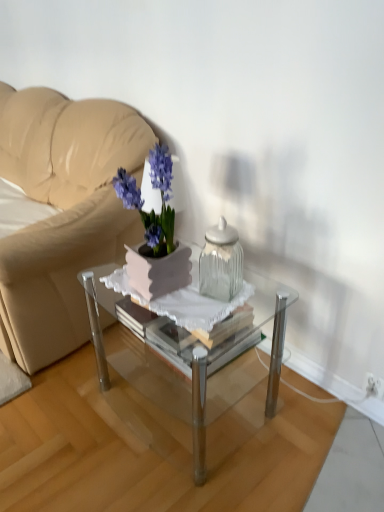
This screenshot has height=512, width=384. Describe the element at coordinates (374, 386) in the screenshot. I see `white plastic electric outlet at lower right` at that location.

In order to click on beige leather couch at upper left in this screenshot , I will do `click(62, 212)`.

The width and height of the screenshot is (384, 512). Describe the element at coordinates (221, 262) in the screenshot. I see `clear glass jar at center` at that location.

Identify the location of matte purple flower pot at center. This screenshot has width=384, height=512. (155, 232).

Describe the element at coordinates (155, 232) in the screenshot. I see `matte purple flower pot at center` at that location.

The width and height of the screenshot is (384, 512). I want to click on clear glass coffee table at center, so click(229, 353).

Looking at this image, could you measure the distance between white plastic electric outlet at lower right and clear glass coffee table at center?

They are 24.55 inches apart.

From the image's perspective, is white plastic electric outlet at lower right below clear glass coffee table at center?

Yes, from the image's perspective, white plastic electric outlet at lower right is beneath clear glass coffee table at center.

Does white plastic electric outlet at lower right have a lesser width compared to clear glass coffee table at center?

Correct, the width of white plastic electric outlet at lower right is less than that of clear glass coffee table at center.

From a real-world perspective, is white plastic electric outlet at lower right physically located above or below clear glass coffee table at center?

From a real-world perspective, white plastic electric outlet at lower right is physically below clear glass coffee table at center.

Consider the image. Would you say clear glass coffee table at center is outside beige leather couch at upper left?

Yes.

Based on the photo, which is behind, clear glass coffee table at center or beige leather couch at upper left?

Positioned behind is beige leather couch at upper left.

From the image's perspective, does clear glass coffee table at center appear lower than beige leather couch at upper left?

Indeed, from the image's perspective, clear glass coffee table at center is shown beneath beige leather couch at upper left.

From the image's perspective, is beige leather couch at upper left positioned above or below clear glass coffee table at center?

From the image's perspective, beige leather couch at upper left appears above clear glass coffee table at center.

Considering the relative sizes of beige leather couch at upper left and clear glass coffee table at center in the image provided, is beige leather couch at upper left thinner than clear glass coffee table at center?

Incorrect, the width of beige leather couch at upper left is not less than that of clear glass coffee table at center.

Is beige leather couch at upper left inside or outside of clear glass coffee table at center?

beige leather couch at upper left is outside clear glass coffee table at center.

Considering the relative sizes of matte purple flower pot at center and clear glass coffee table at center in the image provided, is matte purple flower pot at center smaller than clear glass coffee table at center?

Indeed, matte purple flower pot at center has a smaller size compared to clear glass coffee table at center.

Is matte purple flower pot at center oriented towards clear glass coffee table at center?

No, matte purple flower pot at center is not oriented towards clear glass coffee table at center.

Identify the location of electric outlet that appears on the right of matte purple flower pot at center. (374, 386).

Considering their positions, is matte purple flower pot at center located in front of or behind white plastic electric outlet at lower right?

matte purple flower pot at center is in front of white plastic electric outlet at lower right.

Between matte purple flower pot at center and white plastic electric outlet at lower right, which one has less height?

white plastic electric outlet at lower right is shorter.

From the image's perspective, is matte purple flower pot at center under white plastic electric outlet at lower right?

No.

Locate an element on the screen. This screenshot has width=384, height=512. electric outlet below the clear glass jar at center (from a real-world perspective) is located at coordinates pyautogui.click(x=374, y=386).

From a real-world perspective, is white plastic electric outlet at lower right located beneath clear glass jar at center?

Yes, from a real-world perspective, white plastic electric outlet at lower right is under clear glass jar at center.

Which of these two, white plastic electric outlet at lower right or clear glass jar at center, stands shorter?

With less height is white plastic electric outlet at lower right.

Which is more to the left, white plastic electric outlet at lower right or clear glass jar at center?

Positioned to the left is clear glass jar at center.

Find the location of `houseplant that appears above the clear glass jar at center (from a real-world perspective)`. houseplant that appears above the clear glass jar at center (from a real-world perspective) is located at coordinates (155, 232).

Is clear glass jar at center aimed at matte purple flower pot at center?

No, clear glass jar at center is not oriented towards matte purple flower pot at center.

Can you confirm if clear glass jar at center is positioned to the right of matte purple flower pot at center?

Correct, you'll find clear glass jar at center to the right of matte purple flower pot at center.

Considering the relative sizes of clear glass jar at center and matte purple flower pot at center in the image provided, is clear glass jar at center shorter than matte purple flower pot at center?

Indeed, clear glass jar at center has a lesser height compared to matte purple flower pot at center.

This screenshot has width=384, height=512. In the image, there is a clear glass coffee table at center. Identify the location of electric outlet below it (from the image's perspective). (374, 386).

Where is `coffee table lying in front of the beige leather couch at upper left`? coffee table lying in front of the beige leather couch at upper left is located at coordinates (229, 353).

Considering their positions, is clear glass jar at center positioned closer to matte purple flower pot at center than beige leather couch at upper left?

The object closer to matte purple flower pot at center is clear glass jar at center.

From the image, which object appears to be nearer to clear glass jar at center, clear glass coffee table at center or white plastic electric outlet at lower right?

Based on the image, clear glass coffee table at center appears to be nearer to clear glass jar at center.

From the image, which object appears to be farther from matte purple flower pot at center, beige leather couch at upper left or white plastic electric outlet at lower right?

The object further to matte purple flower pot at center is white plastic electric outlet at lower right.

When comparing their distances from clear glass jar at center, does white plastic electric outlet at lower right or beige leather couch at upper left seem further?

beige leather couch at upper left is positioned further to the anchor clear glass jar at center.

From the picture: When comparing their distances from matte purple flower pot at center, does clear glass coffee table at center or white plastic electric outlet at lower right seem closer?

The object closer to matte purple flower pot at center is clear glass coffee table at center.

Consider the image. Considering their positions, is clear glass jar at center positioned further to beige leather couch at upper left than clear glass coffee table at center?

Based on the image, clear glass jar at center appears to be further to beige leather couch at upper left.

When comparing their distances from matte purple flower pot at center, does beige leather couch at upper left or clear glass coffee table at center seem further?

beige leather couch at upper left is further to matte purple flower pot at center.

Looking at this image, estimate the real-world distances between objects in this image. Which object is closer to white plastic electric outlet at lower right, clear glass coffee table at center or beige leather couch at upper left?

clear glass coffee table at center is closer to white plastic electric outlet at lower right.

The image size is (384, 512). In order to click on houseplant situated between beige leather couch at upper left and clear glass coffee table at center from left to right in this screenshot , I will do `click(155, 232)`.

The width and height of the screenshot is (384, 512). I want to click on vase located between beige leather couch at upper left and white plastic electric outlet at lower right in the left-right direction, so click(221, 262).

Identify the location of houseplant between beige leather couch at upper left and white plastic electric outlet at lower right in the horizontal direction. Image resolution: width=384 pixels, height=512 pixels. [155, 232].

This screenshot has width=384, height=512. Find the location of `houseplant between beige leather couch at upper left and clear glass jar at center in the horizontal direction`. houseplant between beige leather couch at upper left and clear glass jar at center in the horizontal direction is located at coordinates (155, 232).